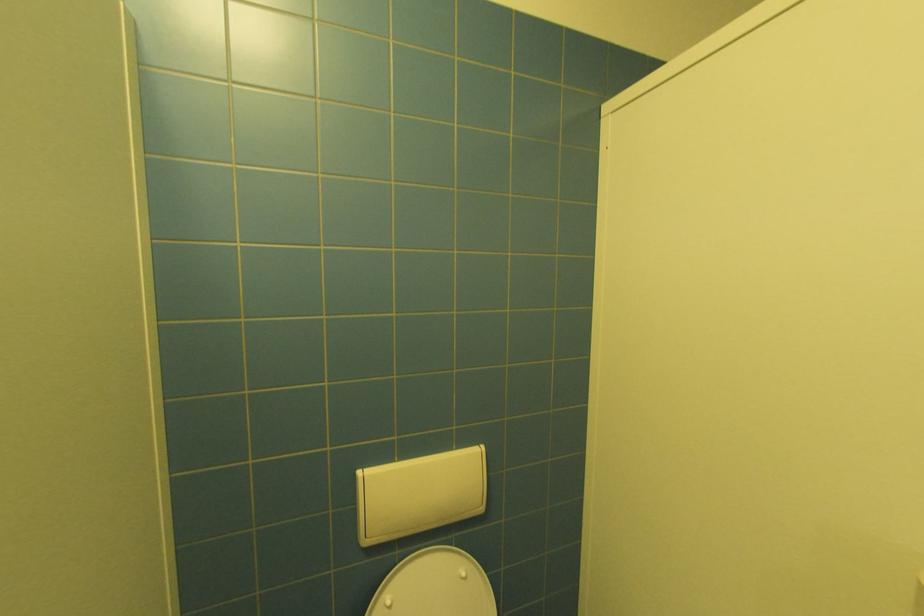
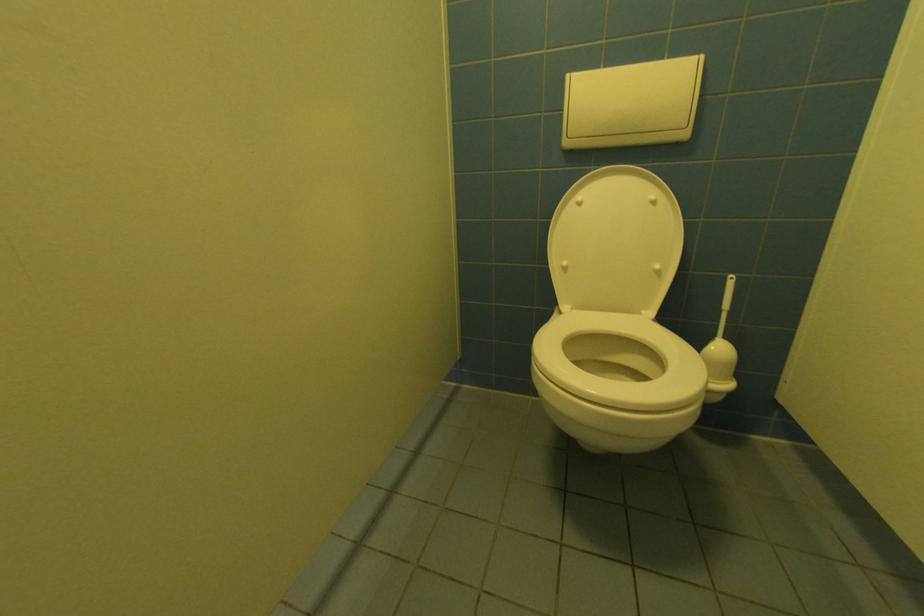
First-person continuous shooting, in which direction is the camera rotating?

The camera's rotation is toward left-down.